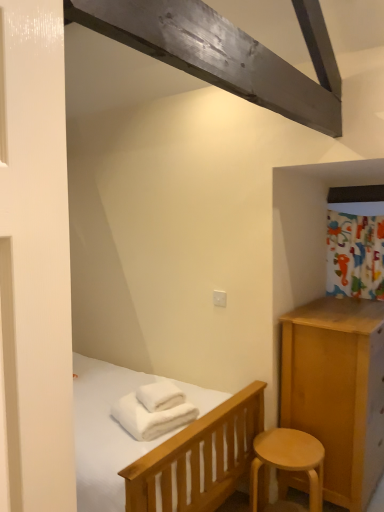
Question: Which is correct: white soft towel at center, which appears as the second bath towel when ordered from the bottom, is inside white soft bath towel at lower center, acting as the first bath towel starting from the bottom, or outside of it?

Choices:
 (A) outside
 (B) inside

Answer: (B)

Question: In terms of size, does white soft towel at center, arranged as the first bath towel when viewed from the top, appear bigger or smaller than white soft bath towel at lower center, the 2th bath towel when ordered from top to bottom?

Choices:
 (A) small
 (B) big

Answer: (A)

Question: Estimate the real-world distances between objects in this image. Which object is closer to the white soft bath towel at lower center, the 2th bath towel when ordered from top to bottom?

Choices:
 (A) light wood stool at lower right
 (B) white soft towel at center, arranged as the first bath towel when viewed from the top

Answer: (B)

Question: Considering the real-world distances, which object is farthest from the light wood stool at lower right?

Choices:
 (A) white soft towel at center, which appears as the second bath towel when ordered from the bottom
 (B) white soft bath towel at lower center, the 2th bath towel when ordered from top to bottom

Answer: (A)